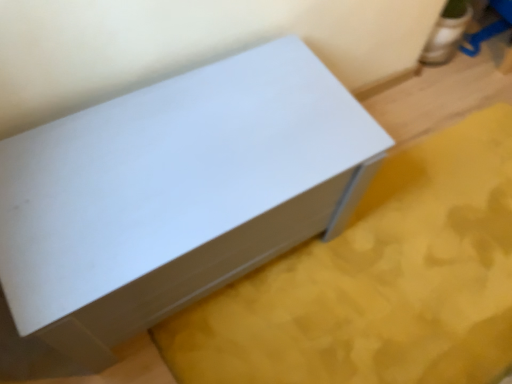
Identify the location of vacant region to the right of white matte table at center. The height and width of the screenshot is (384, 512). (392, 265).